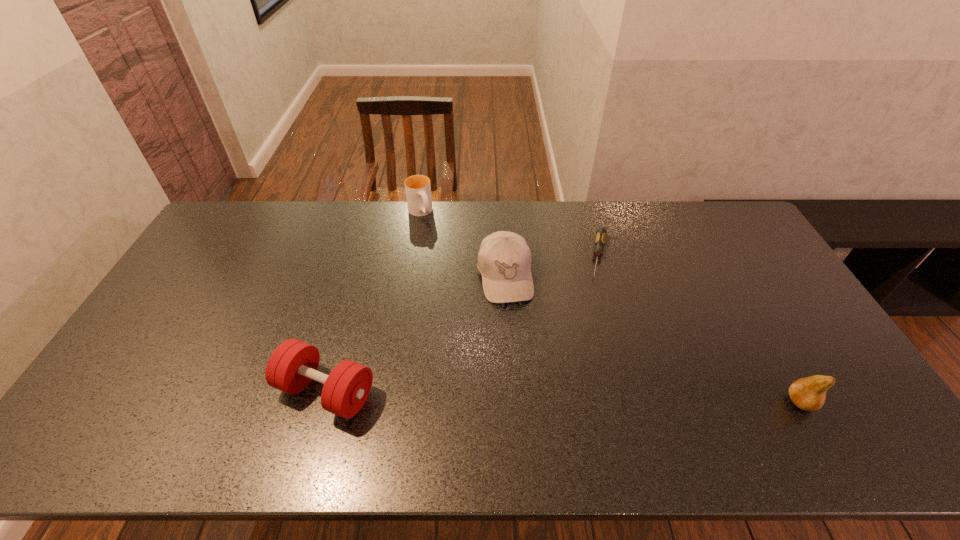
Image resolution: width=960 pixels, height=540 pixels. I want to click on free point that satisfies the following two spatial constraints: 1. on the front side of the third object from left to right; 2. on the left side of the farthest object, so (410, 276).

Where is `free point that satisfies the following two spatial constraints: 1. on the back side of the second object from right to left; 2. on the right side of the third object from right to left`? free point that satisfies the following two spatial constraints: 1. on the back side of the second object from right to left; 2. on the right side of the third object from right to left is located at coordinates (503, 256).

Locate an element on the screen. free space that satisfies the following two spatial constraints: 1. on the back side of the cup; 2. on the right side of the dumbbell is located at coordinates (375, 212).

You are a GUI agent. You are given a task and a screenshot of the screen. Output one action in this format:
    pyautogui.click(x=<x>, y=<y>)
    Task: Click on the free location that satisfies the following two spatial constraints: 1. on the front side of the second object from right to left; 2. on the right side of the cup
    This screenshot has height=540, width=960.
    Given the screenshot: What is the action you would take?
    pyautogui.click(x=413, y=256)

This screenshot has width=960, height=540. What are the coordinates of `blank space that satisfies the following two spatial constraints: 1. on the front side of the baseball cap; 2. on the left side of the rightmost object` in the screenshot? It's located at (512, 402).

The width and height of the screenshot is (960, 540). I want to click on vacant region that satisfies the following two spatial constraints: 1. on the back side of the second object from right to left; 2. on the left side of the dumbbell, so click(364, 256).